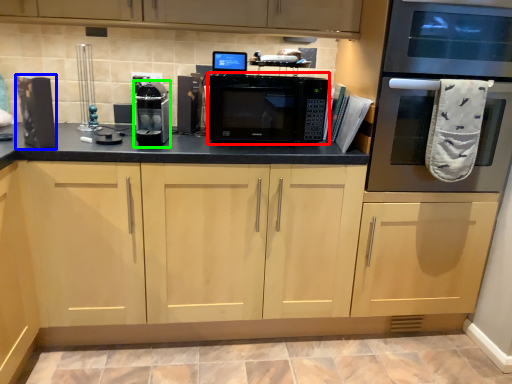
Question: Which object is positioned farthest from microwave oven (highlighted by a red box)? Select from appliance (highlighted by a blue box) and appliance (highlighted by a green box).

Choices:
 (A) appliance
 (B) appliance

Answer: (A)